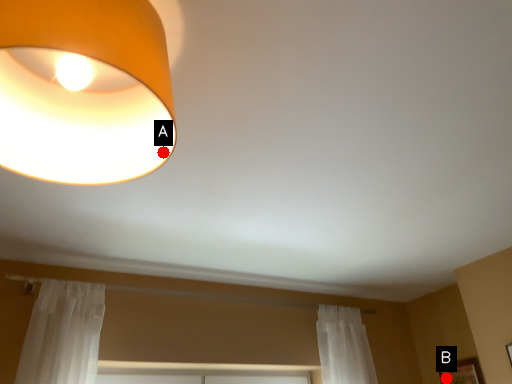
Question: Two points are circled on the image, labeled by A and B beside each circle. Which point is closer to the camera taking this photo?

Choices:
 (A) A is closer
 (B) B is closer

Answer: (A)